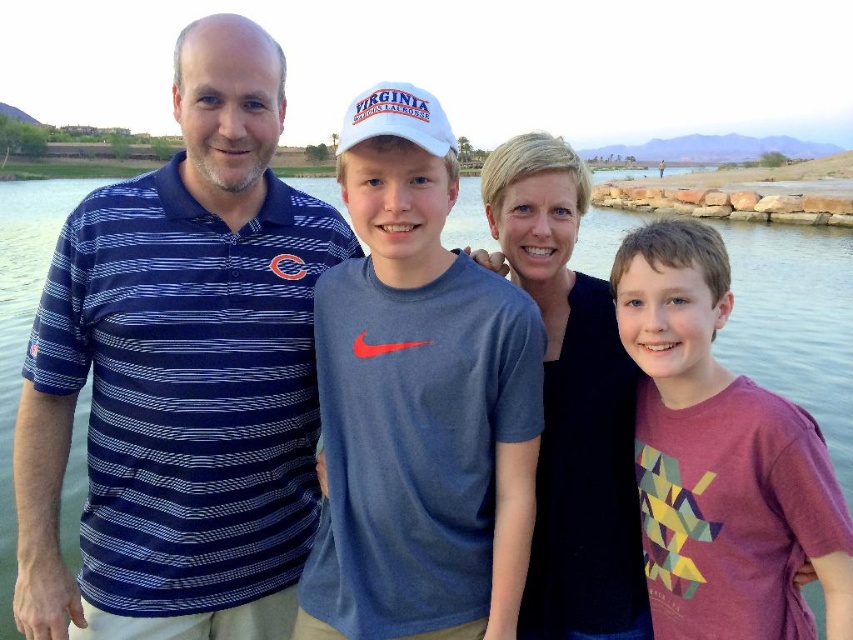
Question: Which of the following is the closest to the observer?

Choices:
 (A) clear water at center
 (B) black matte shirt at center

Answer: (B)

Question: Is the position of blue striped polo shirt at left more distant than that of clear water at center?

Choices:
 (A) yes
 (B) no

Answer: (B)

Question: Does blue cotton t-shirt at center lie behind clear water at center?

Choices:
 (A) no
 (B) yes

Answer: (A)

Question: Which point is farther to the camera?

Choices:
 (A) blue cotton t-shirt at center
 (B) blue striped polo shirt at left
 (C) clear water at center

Answer: (C)

Question: Estimate the real-world distances between objects in this image. Which object is closer to the maroon heathered t-shirt at right?

Choices:
 (A) blue striped polo shirt at left
 (B) black matte shirt at center
 (C) clear water at center
 (D) blue cotton t-shirt at center

Answer: (B)

Question: Does blue striped polo shirt at left appear on the left side of clear water at center?

Choices:
 (A) yes
 (B) no

Answer: (B)